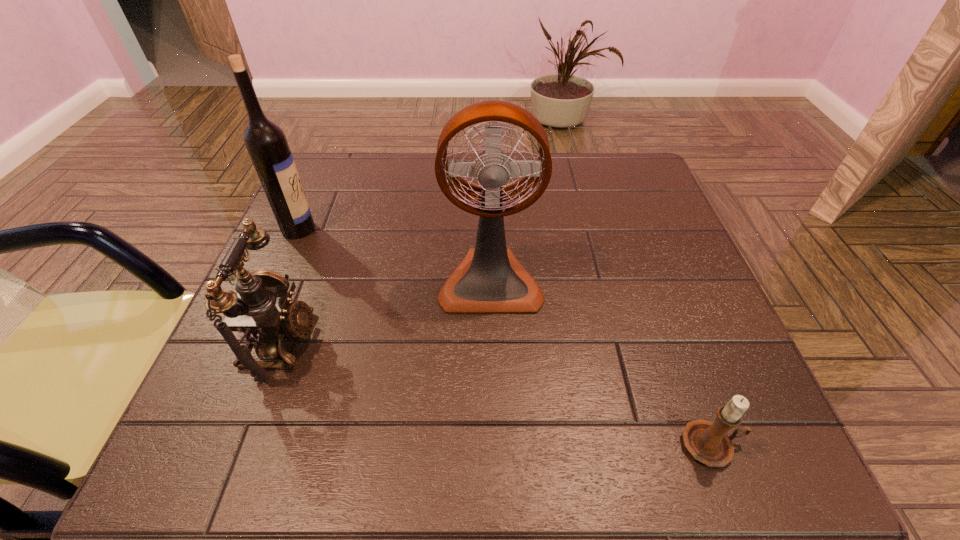
Image resolution: width=960 pixels, height=540 pixels. What are the coordinates of `wine bottle positioned at the left edge` in the screenshot? It's located at (266, 143).

Where is `telephone at the left edge`? This screenshot has height=540, width=960. telephone at the left edge is located at coordinates (261, 310).

Find the location of a particular element. object that is at the right edge is located at coordinates tap(708, 442).

The width and height of the screenshot is (960, 540). I want to click on object that is at the near right corner, so click(708, 442).

The image size is (960, 540). In the image, there is a desktop. What are the coordinates of `free region at the far edge` in the screenshot? It's located at (425, 196).

In order to click on free space at the near edge in this screenshot , I will do `click(370, 456)`.

I want to click on vacant space at the left edge of the desktop, so click(217, 404).

The image size is (960, 540). I want to click on blank space at the right edge of the desktop, so click(667, 276).

Where is `free space at the far left corner of the desktop`? The width and height of the screenshot is (960, 540). free space at the far left corner of the desktop is located at coordinates point(353,161).

This screenshot has width=960, height=540. In the image, there is a desktop. In order to click on blank space at the far right corner in this screenshot , I will do `click(610, 181)`.